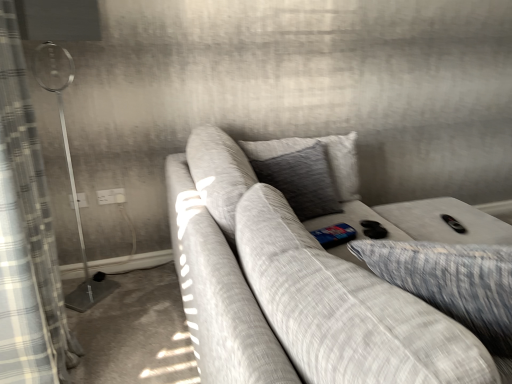
Question: Is gray textured pillow at center, which is the second pillow in right-to-left order, oriented away from plaid fabric curtain at left?

Choices:
 (A) yes
 (B) no

Answer: (B)

Question: Considering the relative sizes of gray textured pillow at center, which is the second pillow in right-to-left order, and plaid fabric curtain at left in the image provided, is gray textured pillow at center, which is the second pillow in right-to-left order, wider than plaid fabric curtain at left?

Choices:
 (A) yes
 (B) no

Answer: (B)

Question: From a real-world perspective, is gray textured pillow at center, which is the second pillow in right-to-left order, located higher than plaid fabric curtain at left?

Choices:
 (A) no
 (B) yes

Answer: (A)

Question: From a real-world perspective, is gray textured pillow at center, arranged as the 1th pillow when viewed from the left, below plaid fabric curtain at left?

Choices:
 (A) no
 (B) yes

Answer: (B)

Question: From the image's perspective, is gray textured pillow at center, which is the second pillow in right-to-left order, on plaid fabric curtain at left?

Choices:
 (A) yes
 (B) no

Answer: (A)

Question: Is textured gray pillow at right, arranged as the 1th pillow when viewed from the right, in front of or behind gray textured pillow at center, which is the second pillow in right-to-left order, in the image?

Choices:
 (A) front
 (B) behind

Answer: (A)

Question: From the image's perspective, is textured gray pillow at right, arranged as the 1th pillow when viewed from the right, positioned above or below gray textured pillow at center, which is the second pillow in right-to-left order?

Choices:
 (A) below
 (B) above

Answer: (A)

Question: Is textured gray pillow at right, arranged as the 1th pillow when viewed from the right, taller or shorter than gray textured pillow at center, arranged as the 1th pillow when viewed from the left?

Choices:
 (A) short
 (B) tall

Answer: (A)

Question: Is textured gray pillow at right, the 2th pillow positioned from the left, to the left or to the right of gray textured pillow at center, which is the second pillow in right-to-left order, in the image?

Choices:
 (A) left
 (B) right

Answer: (B)

Question: From their relative heights in the image, would you say white plastic electric outlet at upper left, marked as the 2th electric outlet in a left-to-right arrangement, is taller or shorter than white plastic electric outlet at lower left, the 2th electric outlet when ordered from right to left?

Choices:
 (A) tall
 (B) short

Answer: (A)

Question: Is point (120, 190) positioned closer to the camera than point (82, 195)?

Choices:
 (A) closer
 (B) farther

Answer: (B)

Question: Is white plastic electric outlet at upper left, placed as the 1th electric outlet when sorted from right to left, wider or thinner than white plastic electric outlet at lower left, the 2th electric outlet when ordered from right to left?

Choices:
 (A) thin
 (B) wide

Answer: (B)

Question: Would you say white plastic electric outlet at upper left, placed as the 1th electric outlet when sorted from right to left, is to the left or to the right of white plastic electric outlet at lower left, the 2th electric outlet when ordered from right to left, in the picture?

Choices:
 (A) left
 (B) right

Answer: (B)

Question: Looking at the image, does gray textured pillow at center, arranged as the 1th pillow when viewed from the left, seem bigger or smaller compared to plaid fabric curtain at left?

Choices:
 (A) big
 (B) small

Answer: (B)

Question: Based on their positions, is gray textured pillow at center, which is the second pillow in right-to-left order, located to the left or right of plaid fabric curtain at left?

Choices:
 (A) left
 (B) right

Answer: (B)